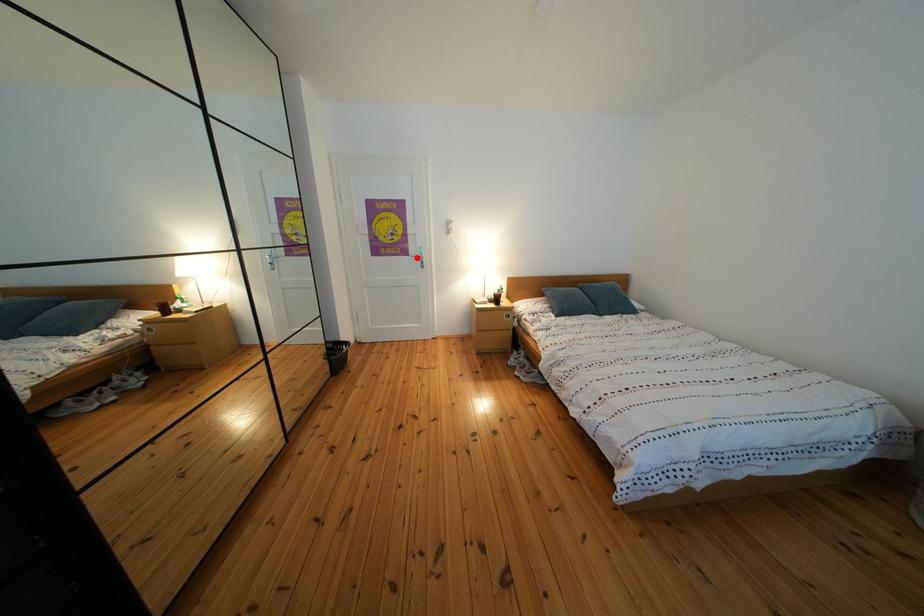
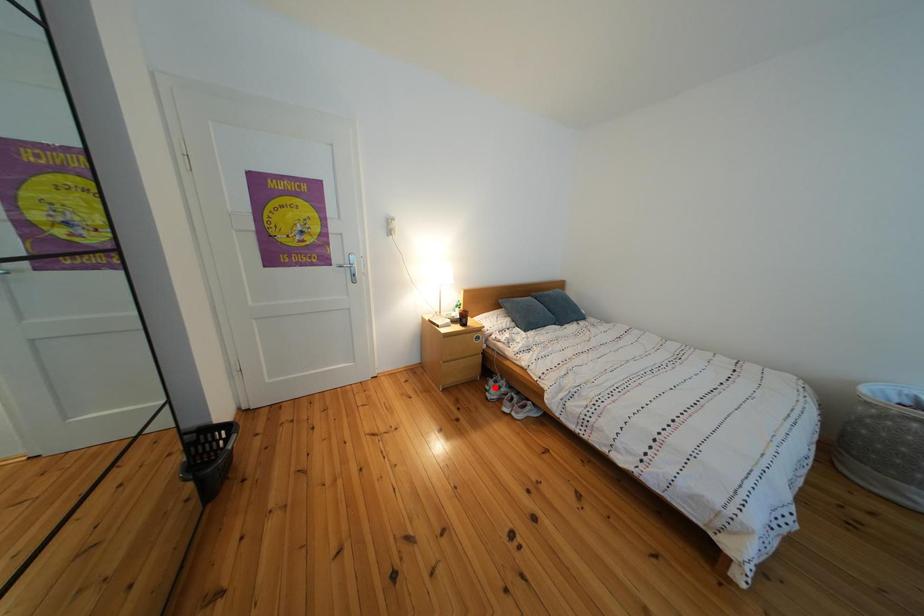
I am providing you with two images of the same scene from different viewpoints. A red point is marked on the first image and another point is marked on the second image. Do the highlighted points in image1 and image2 indicate the same real-world spot?

No